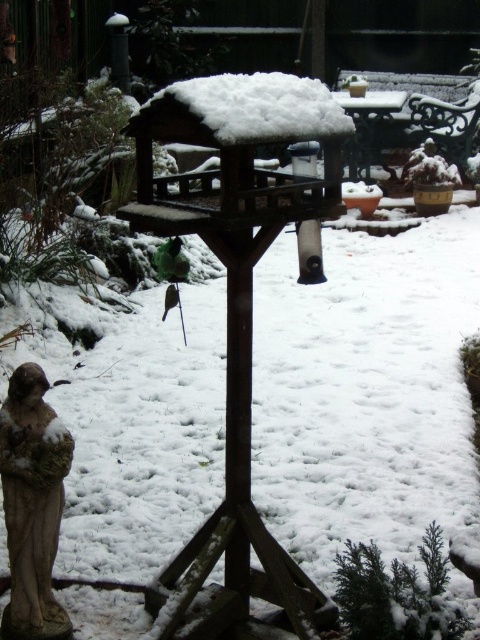
You are a small squirrel trying to reach the white fluffy snow at center from the stone statue at lower left. The squirrel can jump up to 1.5 meters. Do you think the squirrel can make the jump in one go?

The distance between the stone statue at lower left and the white fluffy snow at center is 1.74 meters, which is longer than the squirrel can jump in one go. The squirrel would need to make multiple jumps or find another path.